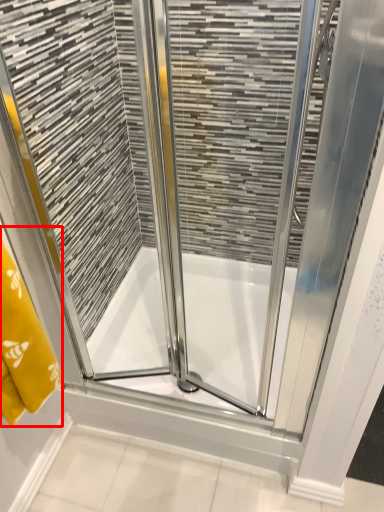
Question: From the image's perspective, where is bath towel (annotated by the red box) located in relation to bath in the image?

Choices:
 (A) above
 (B) below

Answer: (A)